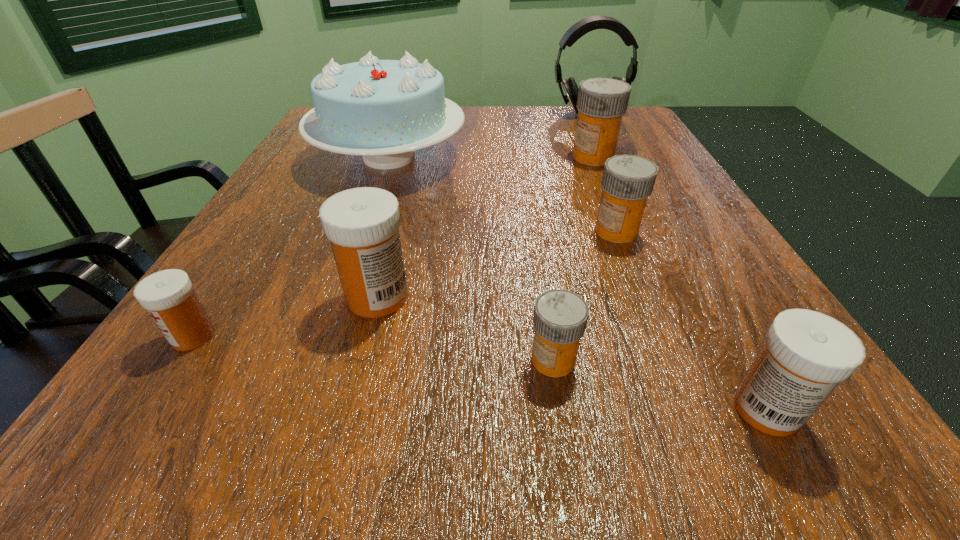
Find the location of `object that is the fourth nearest to the smallest orange medicine`. object that is the fourth nearest to the smallest orange medicine is located at coordinates (383, 110).

You are a GUI agent. You are given a task and a screenshot of the screen. Output one action in this format:
    pyautogui.click(x=<x>, y=<y>)
    Task: Click on the object that is the sixth closest to the leftmost medicine
    The image size is (960, 540).
    Given the screenshot: What is the action you would take?
    pyautogui.click(x=602, y=102)

Find the location of a particular element. medicine that is the closest one to the nearest object is located at coordinates (560, 317).

Where is `the fifth closest medicine to the second farthest orange medicine`? The image size is (960, 540). the fifth closest medicine to the second farthest orange medicine is located at coordinates (168, 296).

Image resolution: width=960 pixels, height=540 pixels. I want to click on the closest orange medicine to the biggest orange medicine, so pyautogui.click(x=628, y=180).

Identify the location of orange medicine that is the third closest to the birthday cake. The height and width of the screenshot is (540, 960). (560, 317).

Locate an element on the screen. white medicine that is the second closest to the biggest white medicine is located at coordinates (806, 354).

Select which white medicine appears as the second closest to the leftmost white medicine. Please provide its 2D coordinates. Your answer should be formatted as a tuple, i.e. [(x, y)], where the tuple contains the x and y coordinates of a point satisfying the conditions above.

[(806, 354)]

Find the location of `free region that satisfies the following two spatial constraints: 1. on the label side of the fourth farthest object; 2. on the back side of the rightmost white medicine`. free region that satisfies the following two spatial constraints: 1. on the label side of the fourth farthest object; 2. on the back side of the rightmost white medicine is located at coordinates (687, 409).

At what (x,y) coordinates should I click in order to perform the action: click on free spot that satisfies the following two spatial constraints: 1. on the label side of the fourth object from left to right; 2. on the right side of the nearest object. Please return your answer as a coordinate pair (x, y). Looking at the image, I should click on click(x=561, y=409).